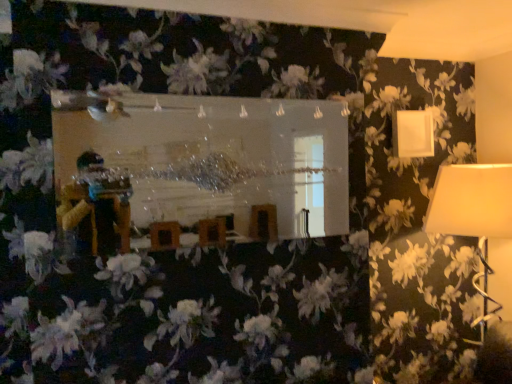
Question: From the image's perspective, is white matte lampshade at upper right, acting as the 2th lamp starting from the bottom, on white fabric lampshade at right, positioned as the first lamp in bottom-to-top order?

Choices:
 (A) yes
 (B) no

Answer: (A)

Question: Would you say white fabric lampshade at right, the second lamp in the top-to-bottom sequence, is part of white matte lampshade at upper right, which is counted as the 1th lamp, starting from the top,'s contents?

Choices:
 (A) no
 (B) yes

Answer: (A)

Question: Is white matte lampshade at upper right, acting as the 2th lamp starting from the bottom, aimed at white fabric lampshade at right, the second lamp in the top-to-bottom sequence?

Choices:
 (A) yes
 (B) no

Answer: (B)

Question: Does white matte lampshade at upper right, acting as the 2th lamp starting from the bottom, have a larger size compared to white fabric lampshade at right, positioned as the first lamp in bottom-to-top order?

Choices:
 (A) no
 (B) yes

Answer: (A)

Question: Can you confirm if white matte lampshade at upper right, which is counted as the 1th lamp, starting from the top, is thinner than white fabric lampshade at right, positioned as the first lamp in bottom-to-top order?

Choices:
 (A) no
 (B) yes

Answer: (B)

Question: Visually, is white matte lampshade at upper right, acting as the 2th lamp starting from the bottom, positioned to the left or to the right of white fabric lampshade at right, positioned as the first lamp in bottom-to-top order?

Choices:
 (A) left
 (B) right

Answer: (A)

Question: Is white matte lampshade at upper right, acting as the 2th lamp starting from the bottom, wider or thinner than white fabric lampshade at right, the second lamp in the top-to-bottom sequence?

Choices:
 (A) wide
 (B) thin

Answer: (B)

Question: Based on their sizes in the image, would you say white matte lampshade at upper right, acting as the 2th lamp starting from the bottom, is bigger or smaller than white fabric lampshade at right, the second lamp in the top-to-bottom sequence?

Choices:
 (A) small
 (B) big

Answer: (A)

Question: Is point (419, 142) positioned closer to the camera than point (489, 178)?

Choices:
 (A) closer
 (B) farther

Answer: (B)

Question: Is white matte lampshade at upper right, acting as the 2th lamp starting from the bottom, taller or shorter than clear glass mirror at center?

Choices:
 (A) tall
 (B) short

Answer: (B)

Question: Considering the positions of white matte lampshade at upper right, which is counted as the 1th lamp, starting from the top, and clear glass mirror at center in the image, is white matte lampshade at upper right, which is counted as the 1th lamp, starting from the top, bigger or smaller than clear glass mirror at center?

Choices:
 (A) big
 (B) small

Answer: (B)

Question: From the image's perspective, is white matte lampshade at upper right, which is counted as the 1th lamp, starting from the top, above or below clear glass mirror at center?

Choices:
 (A) above
 (B) below

Answer: (A)

Question: Visually, is white matte lampshade at upper right, acting as the 2th lamp starting from the bottom, positioned to the left or to the right of clear glass mirror at center?

Choices:
 (A) right
 (B) left

Answer: (A)

Question: Considering their positions, is clear glass mirror at center located in front of or behind white fabric lampshade at right, the second lamp in the top-to-bottom sequence?

Choices:
 (A) behind
 (B) front

Answer: (B)

Question: From their relative heights in the image, would you say clear glass mirror at center is taller or shorter than white fabric lampshade at right, the second lamp in the top-to-bottom sequence?

Choices:
 (A) tall
 (B) short

Answer: (B)